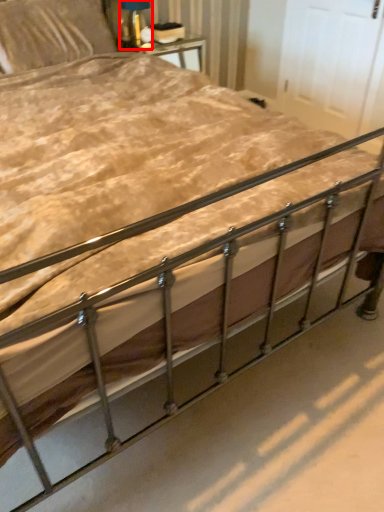
Question: From the image's perspective, where is table lamp (annotated by the red box) located relative to pillow?

Choices:
 (A) below
 (B) above

Answer: (B)